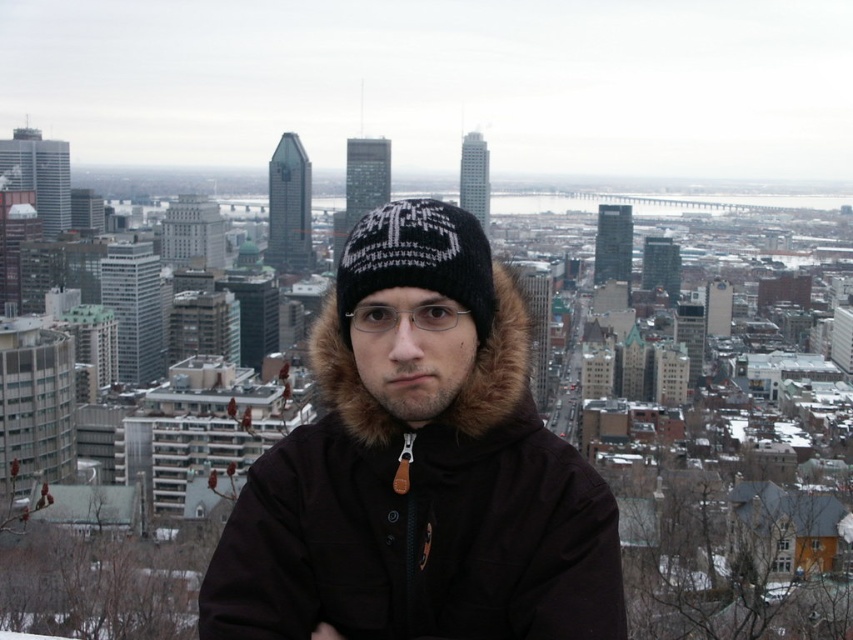
Is brown fur-lined coat at center to the left of black knitted hat at center from the viewer's perspective?

No, brown fur-lined coat at center is not to the left of black knitted hat at center.

Between brown fur-lined coat at center and black knitted hat at center, which one is positioned higher?

black knitted hat at center is above.

The height and width of the screenshot is (640, 853). Find the location of `brown fur-lined coat at center`. brown fur-lined coat at center is located at coordinates (419, 467).